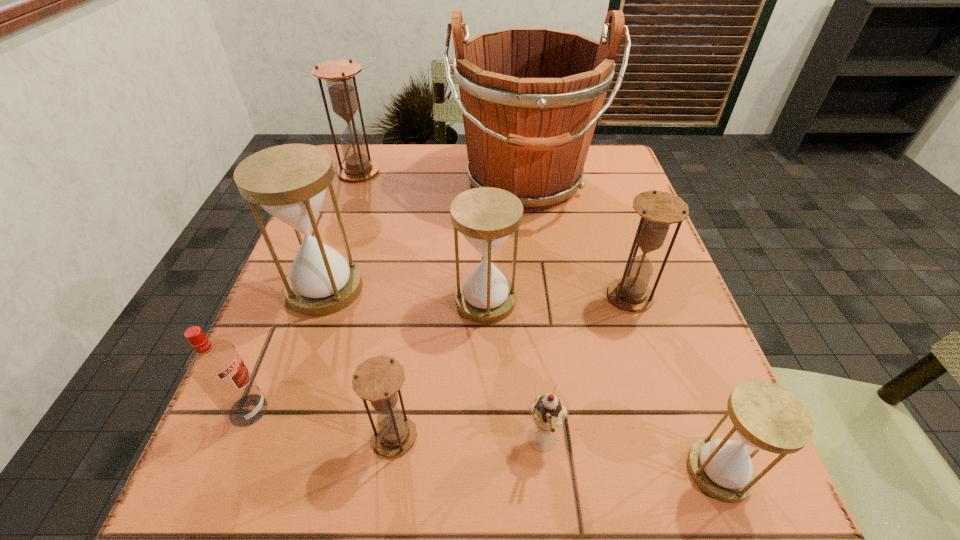
Identify the location of the tallest object. (530, 97).

At what (x,y) coordinates should I click in order to perform the action: click on the biggest brown hourglass. Please return your answer as a coordinate pair (x, y). The height and width of the screenshot is (540, 960). Looking at the image, I should click on (338, 74).

Identify the location of the farthest brown hourglass. (338, 74).

I want to click on the leftmost white hourglass, so (289, 182).

Find the location of a particular element. The width and height of the screenshot is (960, 540). the rightmost brown hourglass is located at coordinates (658, 210).

You are a GUI agent. You are given a task and a screenshot of the screen. Output one action in this format:
    pyautogui.click(x=<x>, y=<y>)
    Task: Click on the second biggest brown hourglass
    The height and width of the screenshot is (540, 960).
    Given the screenshot: What is the action you would take?
    pyautogui.click(x=658, y=210)

Where is `the third hourglass from right to left`? the third hourglass from right to left is located at coordinates (486, 216).

Where is `the second smallest white hourglass`? the second smallest white hourglass is located at coordinates (486, 216).

At what (x,y) coordinates should I click in order to perform the action: click on vodka. Please return your answer as a coordinate pair (x, y). This screenshot has height=540, width=960. Looking at the image, I should click on (216, 366).

The width and height of the screenshot is (960, 540). I want to click on the second brown hourglass from right to left, so click(x=377, y=379).